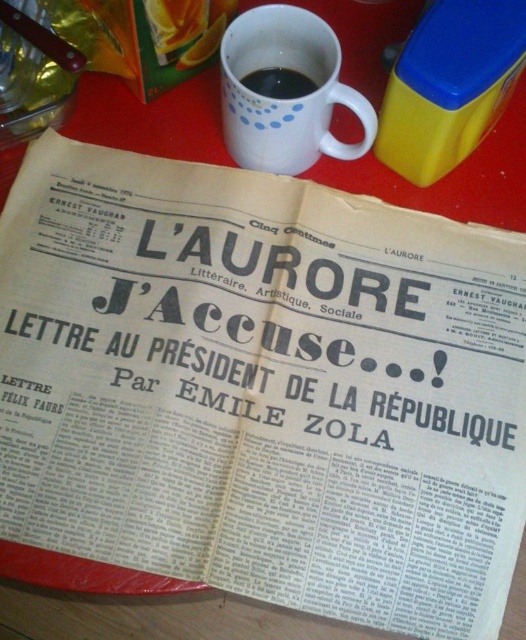
You are standing in front of a newspaper titled L Aurore placed on a red surface. You see a point at (256, 148). If you want to touch that point with a pen that is 1 meter long, can you reach it without moving your hand?

The point at (256, 148) is 1.16 meters away from you, so you cannot reach it with a pen that is 1 meter long without moving your hand.

You are at a cafe and want to grab the white matte mug at upper center and the black matte mug at upper center. Which one do you need to reach over first?

The white matte mug at upper center is closer to the viewer than the black matte mug at upper center, so you need to reach over the white matte mug at upper center first to get to the black matte mug at upper center.

You are a barista who needs to place a new coffee cup on the counter. The newspaper titled L Aurore is on the counter. Where should you place the cup so it doesn t cover the newspaper? Use the point coordinate system where the bottom left corner is 0,0 and the top right corner is 1,1. The newspaper is at position (x=286, y=99). The cup should be placed at least 0.1 units away from the newspaper in all directions. What coordinate would be safe?

A safe coordinate to place the cup would be 0.255, 0.644 since it is 0.1 units away from the newspaper at (x=286, y=99) in both the x and y directions, ensuring it doesn t cover the newspaper.